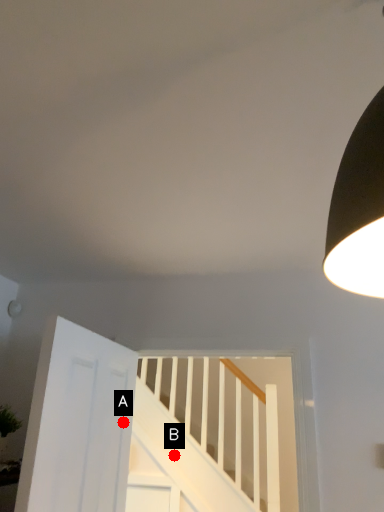
Question: Two points are circled on the image, labeled by A and B beside each circle. Which point is farther to the camera?

Choices:
 (A) A is further
 (B) B is further

Answer: (B)